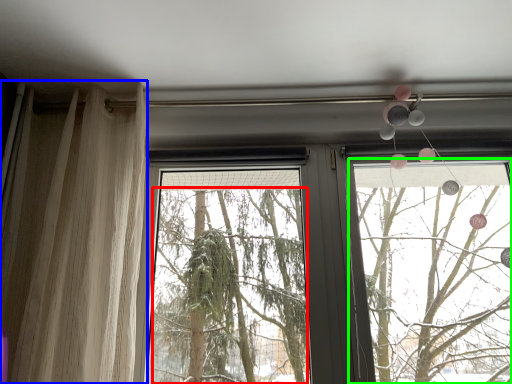
Question: Which object is positioned farthest from tree (highlighted by a red box)? Select from curtain (highlighted by a blue box) and window frame (highlighted by a green box).

Choices:
 (A) curtain
 (B) window frame

Answer: (A)